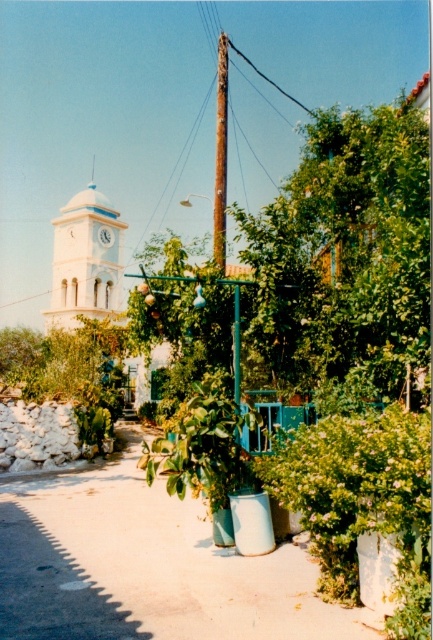
Does green leafy tree at center appear under rusty metal pole at center?

Correct, green leafy tree at center is located below rusty metal pole at center.

Which of these two, green leafy tree at center or rusty metal pole at center, stands shorter?

green leafy tree at center is shorter.

Is point (261, 332) closer to camera compared to point (222, 120)?

Yes, it is in front of point (222, 120).

Where is `green leafy tree at center`? green leafy tree at center is located at coordinates (342, 257).

Is white stucco clock tower at upper left further to camera compared to matte white clock at center?

No.

Measure the distance between point (73,308) and camera.

They are 71.23 meters apart.

Is point (94, 291) behind point (107, 228)?

No, it is in front of (107, 228).

This screenshot has height=640, width=433. What are the coordinates of `white stucco clock tower at upper left` in the screenshot? It's located at (84, 260).

Does green leafy tree at center appear on the left side of matte white clock at center?

No, green leafy tree at center is not to the left of matte white clock at center.

Who is more forward, (x=281, y=278) or (x=109, y=234)?

Point (x=281, y=278)

Does point (158, 339) lie behind point (103, 241)?

That is False.

You are a GUI agent. You are given a task and a screenshot of the screen. Output one action in this format:
    pyautogui.click(x=<x>, y=<y>)
    Task: Click on the green leafy tree at center
    Image resolution: width=433 pixels, height=640 pixels.
    Given the screenshot: What is the action you would take?
    pyautogui.click(x=342, y=257)